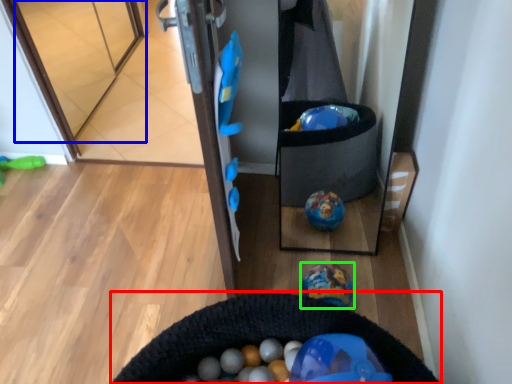
Question: Considering the real-world distances, which object is farthest from cat bed (highlighted by a red box)? glass door (highlighted by a blue box) or toy (highlighted by a green box)?

Choices:
 (A) glass door
 (B) toy

Answer: (A)